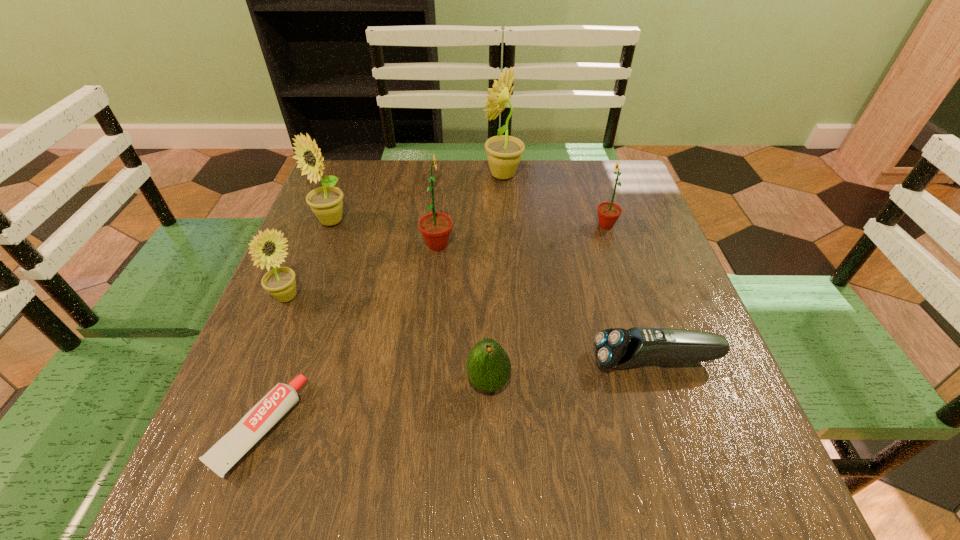
Locate an element on the screen. This screenshot has width=960, height=540. sunflower that is the third closest to the second smallest yellow sunflower is located at coordinates point(504,152).

Identify the location of yellow sunflower that stands as the closest to the avocado. (280, 282).

Find the location of a particular element. yellow sunflower identified as the second closest to the green avocado is located at coordinates (326, 202).

At what (x,y) coordinates should I click in order to perform the action: click on vacant space that satisfies the following two spatial constraints: 1. on the back side of the avocado; 2. on the face of the fifth nearest object. Please return your answer as a coordinate pair (x, y). Looking at the image, I should click on (486, 245).

Locate an element on the screen. This screenshot has height=540, width=960. vacant area in the image that satisfies the following two spatial constraints: 1. on the face of the smallest yellow sunflower; 2. on the back side of the toothpaste is located at coordinates (232, 428).

Image resolution: width=960 pixels, height=540 pixels. I want to click on free space that satisfies the following two spatial constraints: 1. on the back side of the shortest object; 2. on the face of the nearest yellow sunflower, so click(307, 298).

Image resolution: width=960 pixels, height=540 pixels. What are the coordinates of `vacant space that satisfies the following two spatial constraints: 1. on the back side of the shortest object; 2. on the left side of the third shortest object` in the screenshot? It's located at (275, 383).